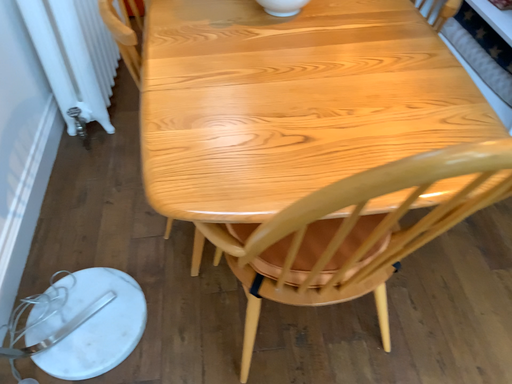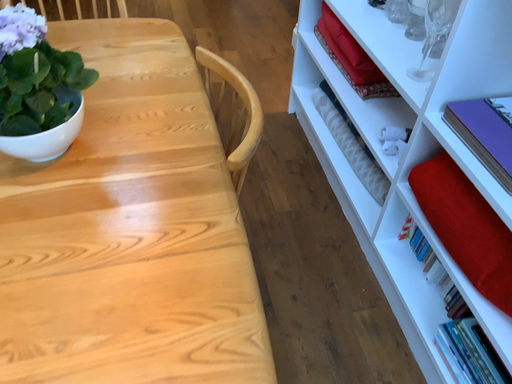
Question: Which way did the camera rotate in the video?

Choices:
 (A) rotated right
 (B) rotated left

Answer: (A)